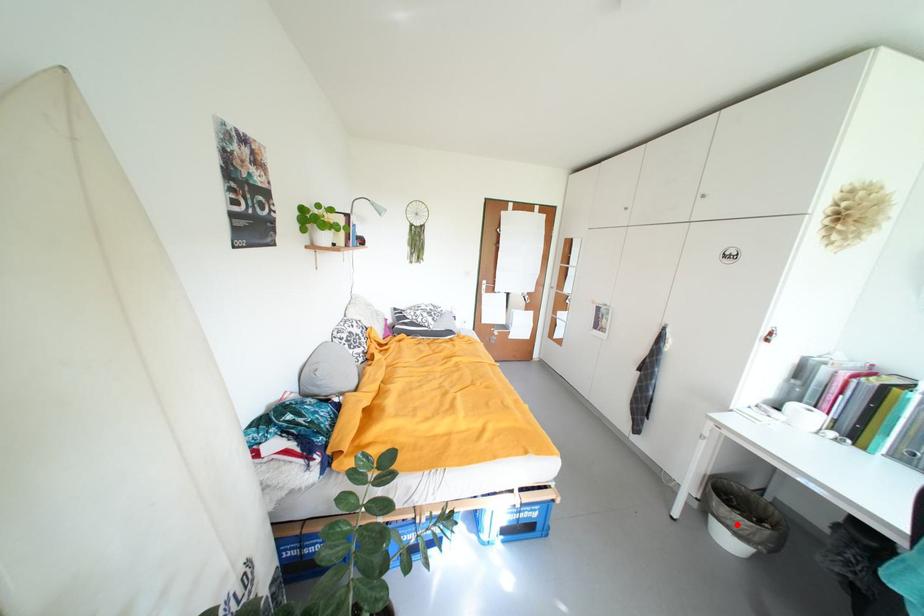
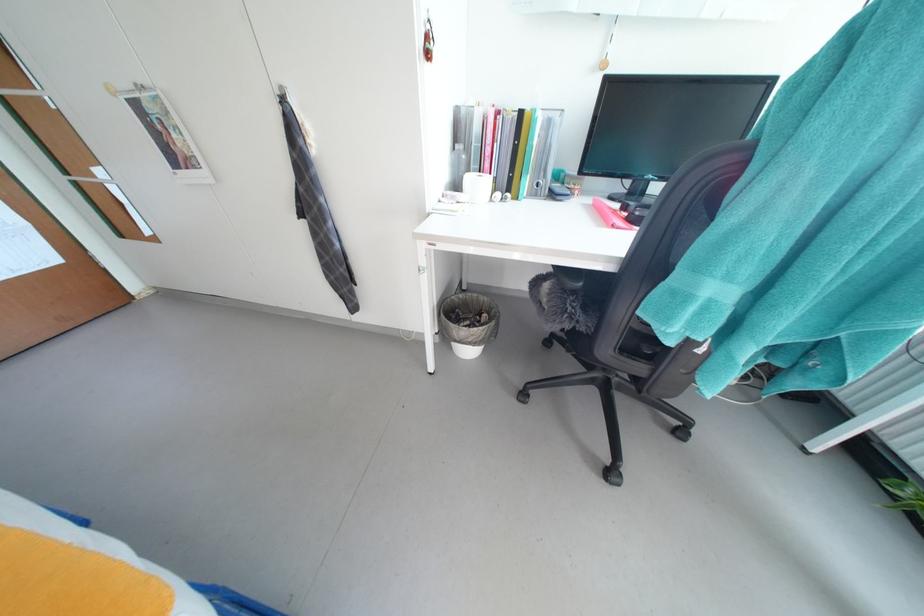
Question: A red point is marked in image1. In image2, is the corresponding 3D point closer to the camera or farther? Reply with the corresponding letter.

Choices:
 (A) The corresponding 3D point is closer.
 (B) The corresponding 3D point is farther.

Answer: (B)